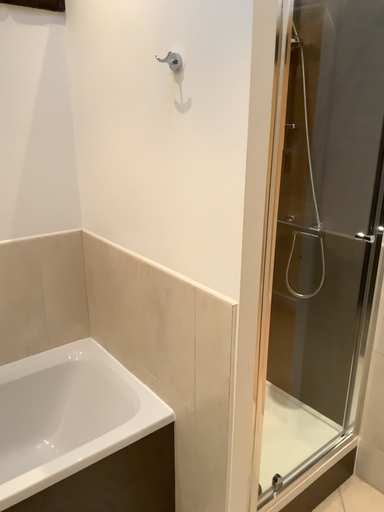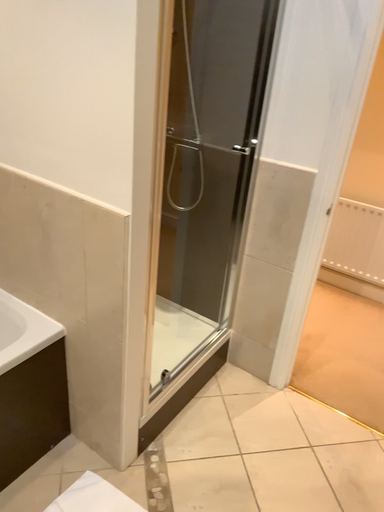
Question: Which way did the camera rotate in the video?

Choices:
 (A) rotated right
 (B) rotated left

Answer: (A)